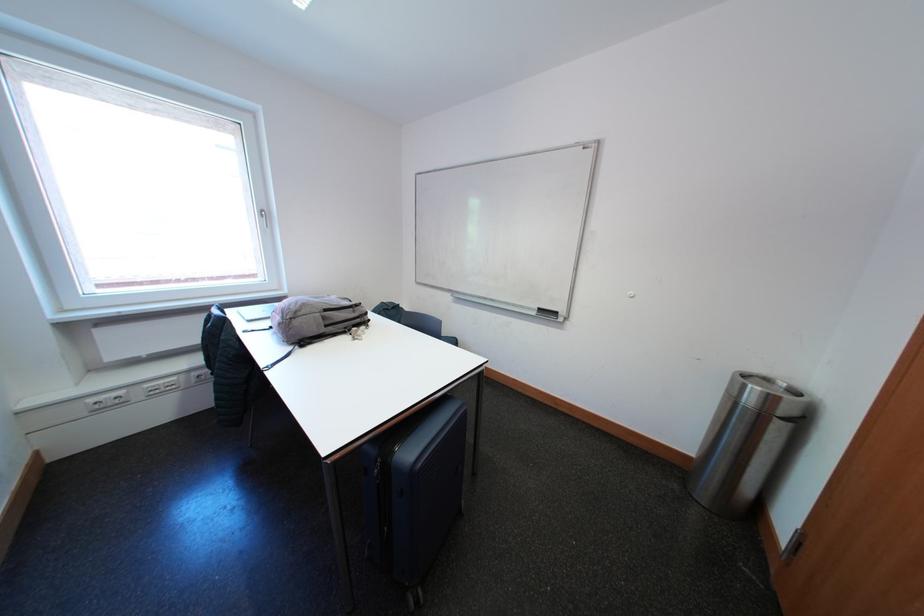
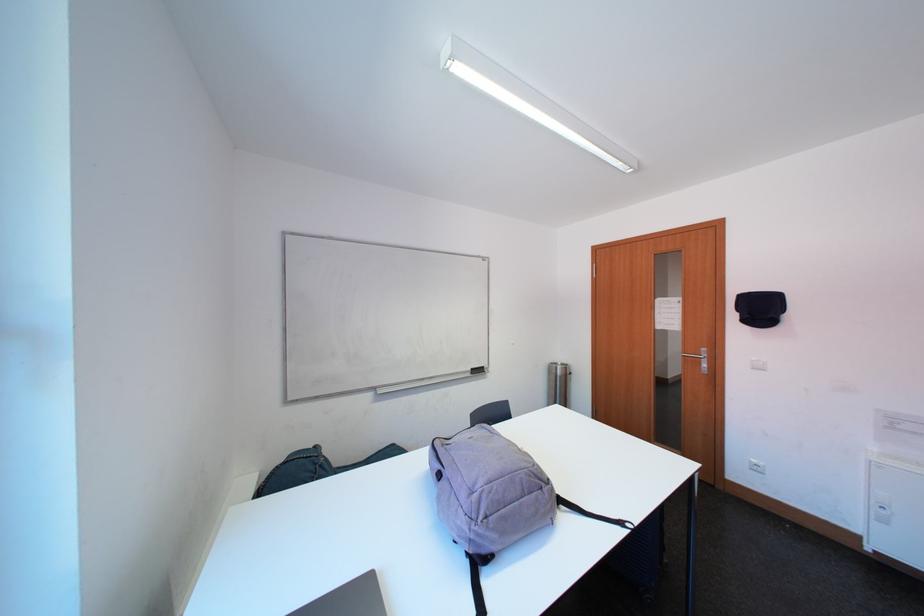
In the second image, find the point that corresponds to the point at 754,389 in the first image.

(565, 371)